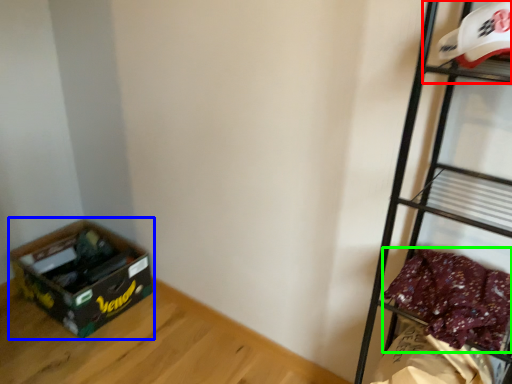
Question: Considering the real-world distances, which object is farthest from shelf (highlighted by a red box)? storage box (highlighted by a blue box) or clothing (highlighted by a green box)?

Choices:
 (A) storage box
 (B) clothing

Answer: (A)